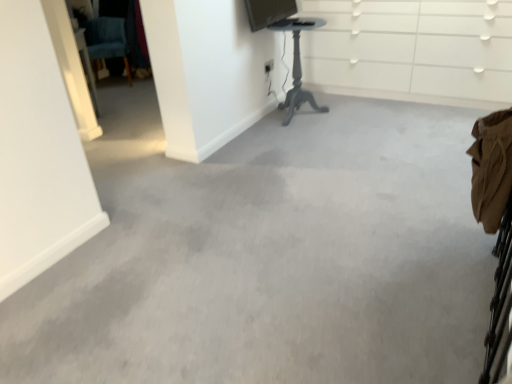
Question: In the image, is teal fabric swivel chair at upper left positioned in front of or behind white glossy dresser at upper center?

Choices:
 (A) behind
 (B) front

Answer: (A)

Question: Does point (87, 29) appear closer or farther from the camera than point (474, 23)?

Choices:
 (A) closer
 (B) farther

Answer: (B)

Question: Which object is the farthest from the white glossy dresser at upper center?

Choices:
 (A) teal fabric swivel chair at upper left
 (B) matte gray table at center
 (C) matte black monitor at upper center

Answer: (A)

Question: Which object is positioned farthest from the matte gray table at center?

Choices:
 (A) teal fabric swivel chair at upper left
 (B) matte black monitor at upper center
 (C) white glossy dresser at upper center

Answer: (A)